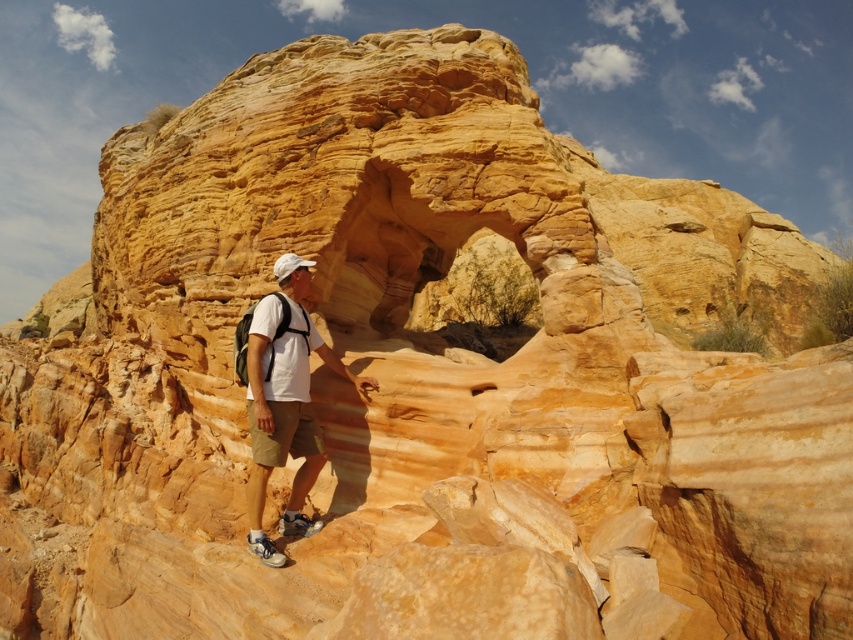
Based on the photo, between white matte shirt at center and white matte baseball hat at center, which one has more height?

white matte shirt at center

Is white matte shirt at center behind white matte baseball hat at center?

No, white matte shirt at center is in front of white matte baseball hat at center.

Who is more forward, (335, 365) or (282, 257)?

Point (335, 365)

This screenshot has width=853, height=640. Find the location of `white matte shirt at center`. white matte shirt at center is located at coordinates (285, 408).